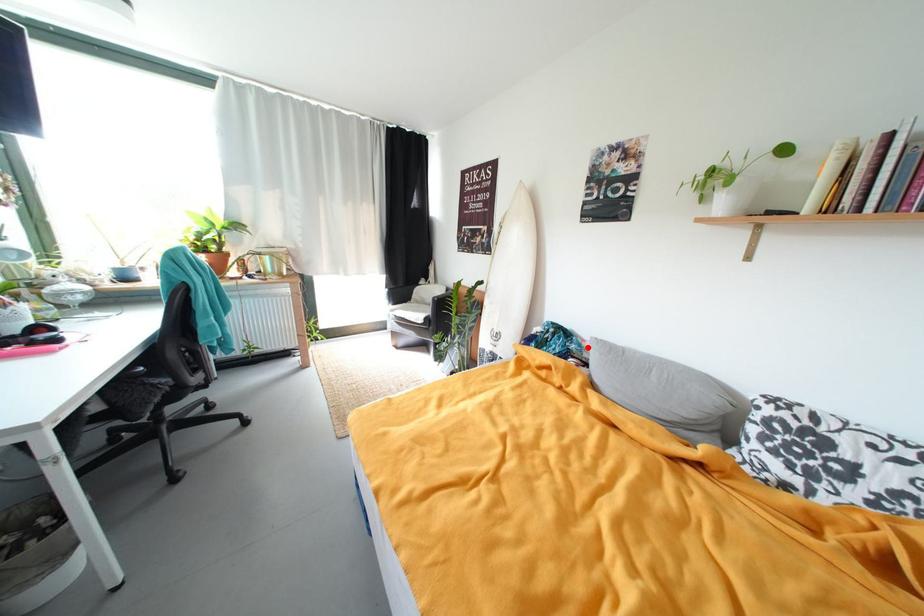
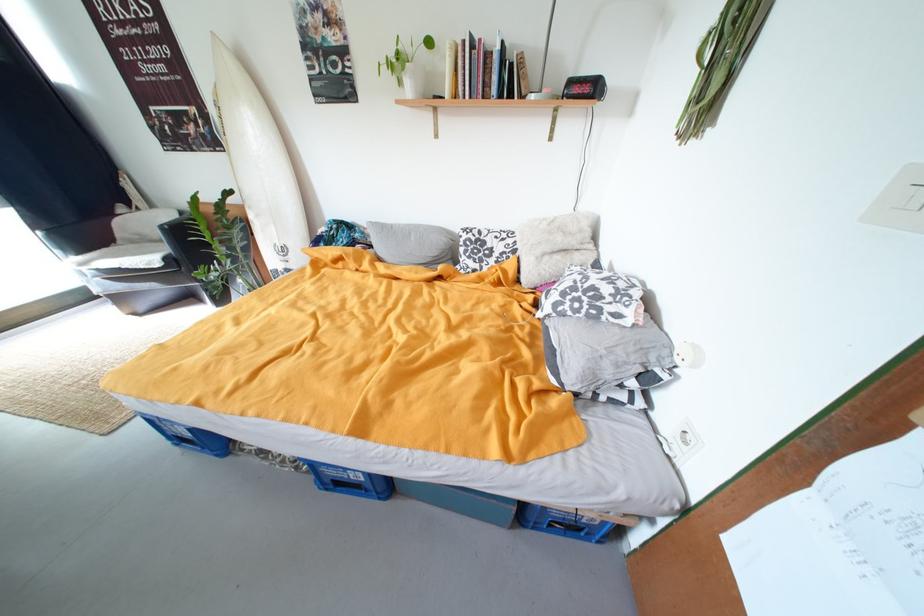
Question: A red point is marked in image1. In image2, is the corresponding 3D point closer to the camera or farther? Reply with the corresponding letter.

Choices:
 (A) The corresponding 3D point is closer.
 (B) The corresponding 3D point is farther.

Answer: (A)